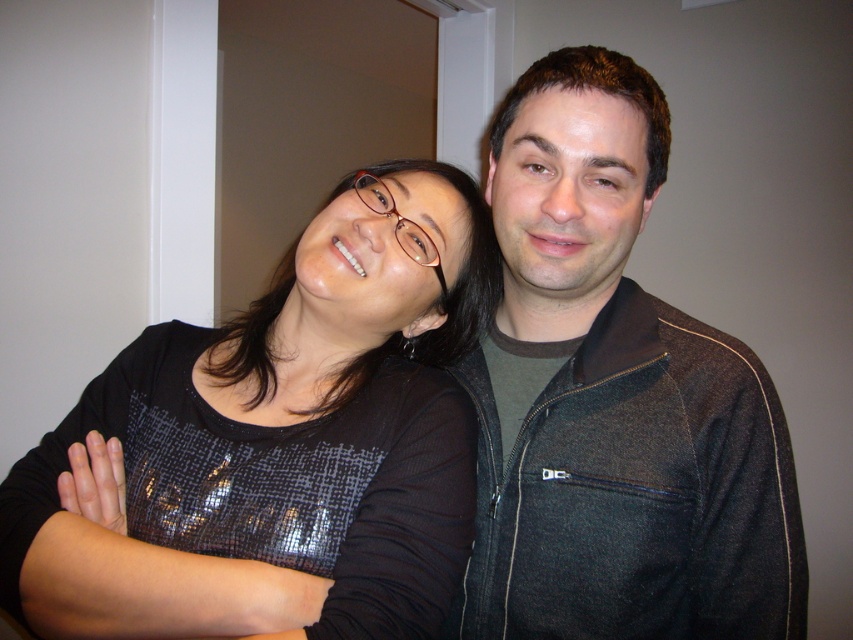
Can you confirm if black sequined top at center is thinner than dark gray fleece jacket at center?

In fact, black sequined top at center might be wider than dark gray fleece jacket at center.

Which is behind, point (186, 416) or point (584, 170)?

The point (186, 416) is more distant.

Which is behind, point (146, 368) or point (556, 54)?

Point (146, 368)

Find the location of a particular element. This screenshot has width=853, height=640. black sequined top at center is located at coordinates (281, 442).